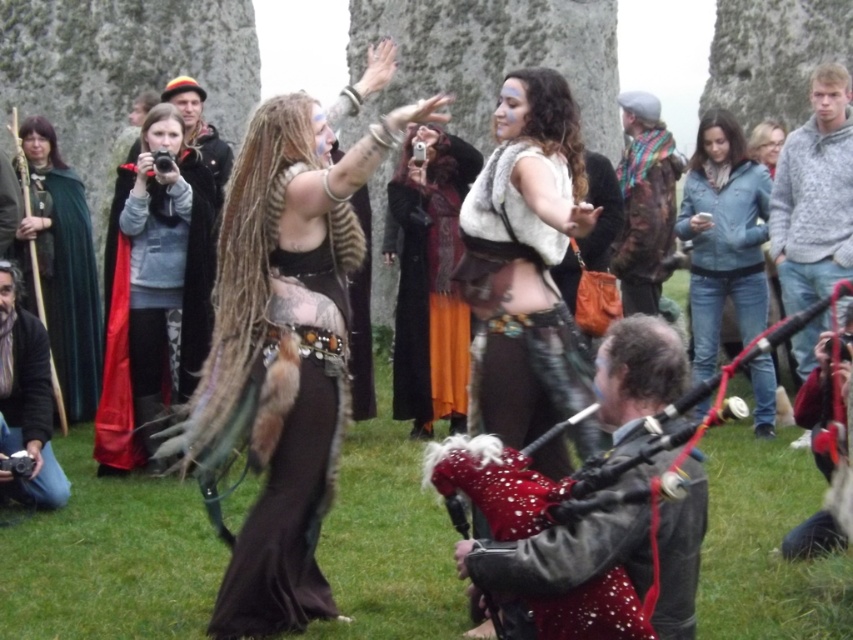
Which is behind, point (654, 461) or point (618, 244)?

The point (618, 244) is behind.

Who is lower down, red velvet bagpipe at lower center or camouflage jacket at center?

Positioned lower is red velvet bagpipe at lower center.

This screenshot has width=853, height=640. Find the location of `red velvet bagpipe at lower center`. red velvet bagpipe at lower center is located at coordinates (567, 556).

This screenshot has height=640, width=853. What are the coordinates of `red velvet bagpipe at lower center` in the screenshot? It's located at (567, 556).

Which of these two, velvet cape at upper left or fur-covered dress at center, stands taller?

With more height is velvet cape at upper left.

Does point (138, 454) lie behind point (312, 522)?

That is True.

Is point (196, 160) farther from viewer compared to point (337, 323)?

That is True.

Image resolution: width=853 pixels, height=640 pixels. I want to click on velvet cape at upper left, so [x=154, y=289].

Who is more distant from viewer, (422, 224) or (756, 189)?

Positioned behind is point (756, 189).

At what (x,y) coordinates should I click in order to perform the action: click on orange velvet dress at center. Please return your answer as a coordinate pair (x, y). Looking at the image, I should click on (428, 280).